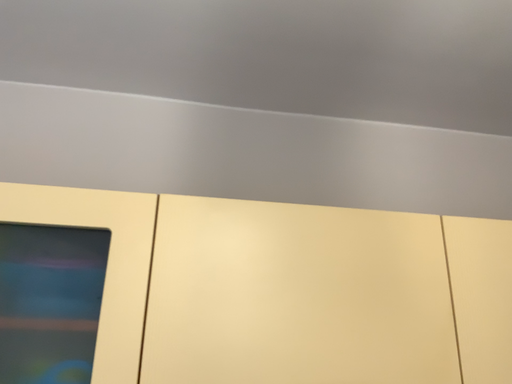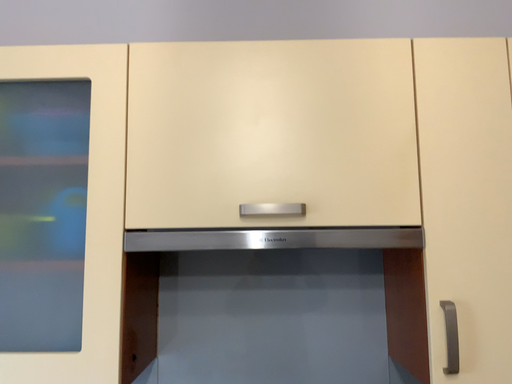
Question: How did the camera likely rotate when shooting the video?

Choices:
 (A) rotated left
 (B) rotated right

Answer: (A)